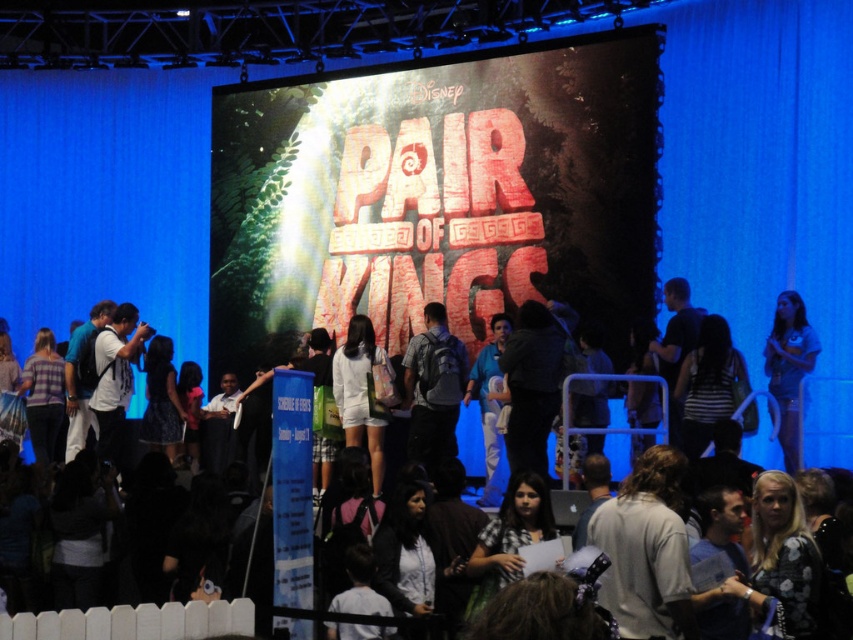
Who is lower down, dark fabric coat at center or blue fabric shirt at center?

Positioned lower is blue fabric shirt at center.

Between dark fabric coat at center and blue fabric shirt at center, which one is positioned higher?

dark fabric coat at center

Between point (544, 321) and point (473, 384), which one is positioned in front?

Point (544, 321)

Identify the location of dark fabric coat at center. (531, 385).

Who is more distant from viewer, (x=444, y=184) or (x=445, y=401)?

The point (x=444, y=184) is more distant.

Is textured paper poster at center thinner than matte gray backpack at center?

No, textured paper poster at center is not thinner than matte gray backpack at center.

Measure the distance between point (508, 65) and camera.

The distance of point (508, 65) from camera is 78.38 meters.

Where is `textured paper poster at center`? This screenshot has width=853, height=640. textured paper poster at center is located at coordinates 436,195.

What do you see at coordinates (436, 195) in the screenshot? I see `textured paper poster at center` at bounding box center [436, 195].

Is the position of textured paper poster at center more distant than that of blue fabric shirt at center?

That is False.

Is point (614, 275) positioned in front of point (490, 365)?

Yes, point (614, 275) is closer to viewer.

At what (x,y) coordinates should I click in order to perform the action: click on textured paper poster at center. Please return your answer as a coordinate pair (x, y). The width and height of the screenshot is (853, 640). Looking at the image, I should click on (436, 195).